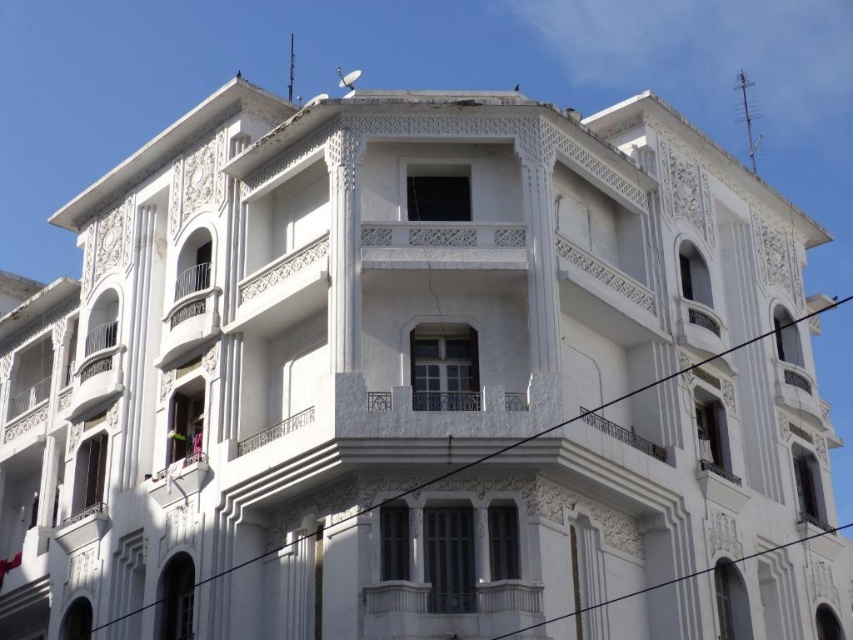
How far apart are black wire at center and metallic wire at lower right?

black wire at center and metallic wire at lower right are 9.19 meters apart.

Can you confirm if black wire at center is positioned to the left of metallic wire at lower right?

Correct, you'll find black wire at center to the left of metallic wire at lower right.

Is point (701, 570) positioned in front of point (802, 536)?

Yes, point (701, 570) is in front of point (802, 536).

You are a GUI agent. You are given a task and a screenshot of the screen. Output one action in this format:
    pyautogui.click(x=<x>, y=<y>)
    Task: Click on the black wire at center
    Image resolution: width=853 pixels, height=640 pixels.
    Given the screenshot: What is the action you would take?
    pyautogui.click(x=598, y=406)